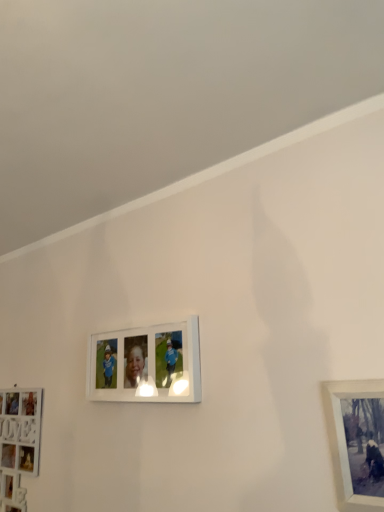
Question: From a real-world perspective, is metallic silver frame at lower right, marked as the 1th picture frame in a front-to-back arrangement, positioned over white matte picture frame at lower left, the 3th picture frame from the front, based on gravity?

Choices:
 (A) yes
 (B) no

Answer: (A)

Question: Can you confirm if metallic silver frame at lower right, the third picture frame from the left, is taller than white matte picture frame at lower left, the 3th picture frame from the front?

Choices:
 (A) yes
 (B) no

Answer: (B)

Question: Does metallic silver frame at lower right, the 3th picture frame from the back, have a smaller size compared to white matte picture frame at lower left, which appears as the first picture frame when viewed from the back?

Choices:
 (A) no
 (B) yes

Answer: (B)

Question: Can you confirm if metallic silver frame at lower right, the third picture frame from the left, is bigger than white matte picture frame at lower left, the first picture frame positioned from the left?

Choices:
 (A) yes
 (B) no

Answer: (B)

Question: Is metallic silver frame at lower right, the 3th picture frame from the back, located outside white matte picture frame at lower left, the 3th picture frame from the front?

Choices:
 (A) no
 (B) yes

Answer: (B)

Question: Is metallic silver frame at lower right, the 3th picture frame from the back, aimed at white matte picture frame at lower left, the 3th picture frame from the front?

Choices:
 (A) yes
 (B) no

Answer: (B)

Question: Is white matte picture frame at lower left, which appears as the first picture frame when viewed from the back, positioned far away from white glossy picture frame at center, which appears as the 2th picture frame when viewed from the back?

Choices:
 (A) no
 (B) yes

Answer: (A)

Question: Considering the relative positions of white matte picture frame at lower left, the first picture frame positioned from the left, and white glossy picture frame at center, which ranks as the second picture frame in right-to-left order, in the image provided, is white matte picture frame at lower left, the first picture frame positioned from the left, to the left of white glossy picture frame at center, which ranks as the second picture frame in right-to-left order, from the viewer's perspective?

Choices:
 (A) no
 (B) yes

Answer: (B)

Question: Is white matte picture frame at lower left, the 3th picture frame from the front, oriented away from white glossy picture frame at center, which ranks as the second picture frame in right-to-left order?

Choices:
 (A) yes
 (B) no

Answer: (B)

Question: From the image's perspective, is white matte picture frame at lower left, the 3th picture frame from the front, under white glossy picture frame at center, the 2th picture frame from the left?

Choices:
 (A) no
 (B) yes

Answer: (B)

Question: Is white matte picture frame at lower left, the first picture frame positioned from the left, taller than white glossy picture frame at center, which appears as the 2th picture frame when viewed from the back?

Choices:
 (A) no
 (B) yes

Answer: (B)

Question: Is white matte picture frame at lower left, which is the 3th picture frame in right-to-left order, to the right of white glossy picture frame at center, the 2th picture frame viewed from the front, from the viewer's perspective?

Choices:
 (A) no
 (B) yes

Answer: (A)

Question: Is white glossy picture frame at center, which appears as the 2th picture frame when viewed from the back, in contact with metallic silver frame at lower right, marked as the 1th picture frame in a front-to-back arrangement?

Choices:
 (A) no
 (B) yes

Answer: (A)